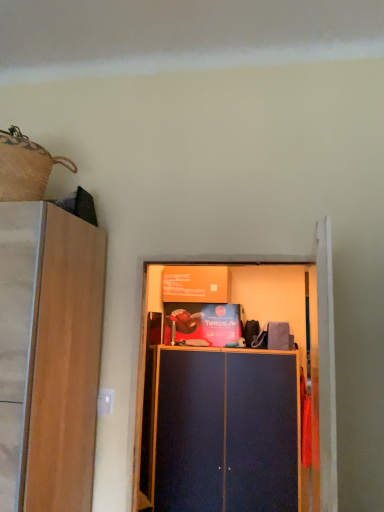
Question: In terms of size, does matte dark blue cabinet at center appear bigger or smaller than blue matte cupboard at center?

Choices:
 (A) small
 (B) big

Answer: (B)

Question: In terms of width, does matte dark blue cabinet at center look wider or thinner when compared to blue matte cupboard at center?

Choices:
 (A) thin
 (B) wide

Answer: (B)

Question: From a real-world perspective, is matte dark blue cabinet at center positioned above or below blue matte cupboard at center?

Choices:
 (A) below
 (B) above

Answer: (A)

Question: Does point (332, 384) appear closer or farther from the camera than point (291, 470)?

Choices:
 (A) farther
 (B) closer

Answer: (B)

Question: Is blue matte cupboard at center spatially inside matte dark blue cabinet at center, or outside of it?

Choices:
 (A) inside
 (B) outside

Answer: (B)

Question: In the image, is blue matte cupboard at center positioned in front of or behind matte dark blue cabinet at center?

Choices:
 (A) front
 (B) behind

Answer: (A)

Question: Considering the relative positions of blue matte cupboard at center and matte dark blue cabinet at center in the image provided, is blue matte cupboard at center to the left or to the right of matte dark blue cabinet at center?

Choices:
 (A) left
 (B) right

Answer: (A)